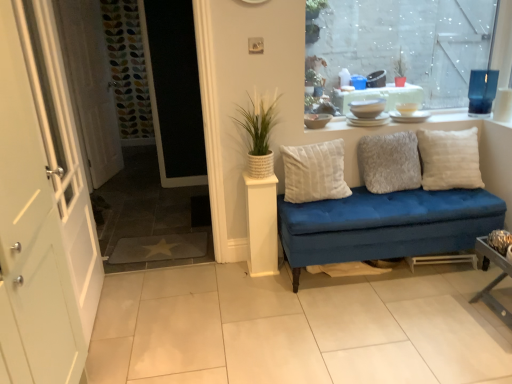
Question: Is white tile at center thinner than white soft cushion at right, marked as the first pillow in a right-to-left arrangement?

Choices:
 (A) no
 (B) yes

Answer: (A)

Question: Is the depth of white tile at center greater than that of white soft cushion at right, which appears as the third pillow when viewed from the left?

Choices:
 (A) no
 (B) yes

Answer: (A)

Question: From a real-world perspective, is white tile at center located higher than white soft cushion at right, marked as the first pillow in a right-to-left arrangement?

Choices:
 (A) no
 (B) yes

Answer: (A)

Question: Does white tile at center turn towards white soft cushion at right, which appears as the third pillow when viewed from the left?

Choices:
 (A) no
 (B) yes

Answer: (A)

Question: Is white tile at center bigger than white soft cushion at right, marked as the first pillow in a right-to-left arrangement?

Choices:
 (A) yes
 (B) no

Answer: (A)

Question: From the image's perspective, is white painted wood door at left positioned above or below white ceramic dishes at upper center?

Choices:
 (A) below
 (B) above

Answer: (A)

Question: Relative to white ceramic dishes at upper center, is white painted wood door at left in front or behind?

Choices:
 (A) behind
 (B) front

Answer: (B)

Question: Is white painted wood door at left taller or shorter than white ceramic dishes at upper center?

Choices:
 (A) tall
 (B) short

Answer: (A)

Question: In terms of size, does white painted wood door at left appear bigger or smaller than white ceramic dishes at upper center?

Choices:
 (A) big
 (B) small

Answer: (A)

Question: Is metallic silver table at lower right, which ranks as the 1th table in right-to-left order, inside the boundaries of transparent glass window at upper right, or outside?

Choices:
 (A) inside
 (B) outside

Answer: (B)

Question: Relative to transparent glass window at upper right, is metallic silver table at lower right, which ranks as the second table in left-to-right order, in front or behind?

Choices:
 (A) behind
 (B) front

Answer: (B)

Question: Does point (488, 299) appear closer or farther from the camera than point (437, 64)?

Choices:
 (A) closer
 (B) farther

Answer: (A)

Question: From a real-world perspective, is metallic silver table at lower right, which ranks as the 1th table in right-to-left order, positioned above or below transparent glass window at upper right?

Choices:
 (A) above
 (B) below

Answer: (B)

Question: From a real-world perspective, relative to white cotton cushion at center, marked as the first pillow in a left-to-right arrangement, is white textured door at left vertically above or below?

Choices:
 (A) above
 (B) below

Answer: (A)

Question: Based on their positions, is white textured door at left located to the left or right of white cotton cushion at center, the 3th pillow viewed from the right?

Choices:
 (A) right
 (B) left

Answer: (B)